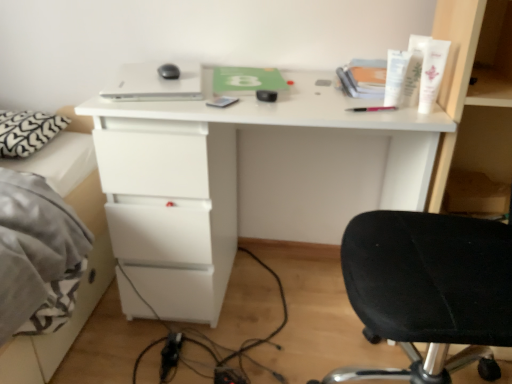
Locate an element on the screen. white plastic tube at upper right, the second toiletry when ordered from left to right is located at coordinates (413, 71).

The height and width of the screenshot is (384, 512). What do you see at coordinates (27, 131) in the screenshot?
I see `white heart-patterned pillow at left` at bounding box center [27, 131].

At what (x,y) coordinates should I click in order to perform the action: click on matte gray notepad at center. Please return your answer as a coordinate pair (x, y). Image resolution: width=512 pixels, height=384 pixels. Looking at the image, I should click on (222, 101).

Find the location of `white cream tube at upper right, the 3th toiletry positioned from the right`. white cream tube at upper right, the 3th toiletry positioned from the right is located at coordinates (395, 76).

Is white heart-patterned pillow at left taller or shorter than white plastic tube at upper right, the 3th toiletry when ordered from left to right?

Clearly, white heart-patterned pillow at left is shorter compared to white plastic tube at upper right, the 3th toiletry when ordered from left to right.

Considering the positions of objects white heart-patterned pillow at left and white plastic tube at upper right, which is counted as the 1th toiletry, starting from the right, in the image provided, who is more to the left, white heart-patterned pillow at left or white plastic tube at upper right, which is counted as the 1th toiletry, starting from the right,?

Positioned to the left is white heart-patterned pillow at left.

From a real-world perspective, which object stands above the other?

white plastic tube at upper right, which is counted as the 1th toiletry, starting from the right, is physically above.

Is matte gray notepad at center next to white cream tube at upper right, which is counted as the first toiletry, starting from the left?

There is a gap between matte gray notepad at center and white cream tube at upper right, which is counted as the first toiletry, starting from the left.

Is matte gray notepad at center facing towards white cream tube at upper right, the 3th toiletry positioned from the right?

No, matte gray notepad at center is not aimed at white cream tube at upper right, the 3th toiletry positioned from the right.

How many degrees apart are the facing directions of matte gray notepad at center and white cream tube at upper right, which is counted as the first toiletry, starting from the left?

2.25 degrees separate the facing orientations of matte gray notepad at center and white cream tube at upper right, which is counted as the first toiletry, starting from the left.

Find the location of `notepad below the white cream tube at upper right, the 3th toiletry positioned from the right (from the image's perspective)`. notepad below the white cream tube at upper right, the 3th toiletry positioned from the right (from the image's perspective) is located at coordinates (222, 101).

From a real-world perspective, between white matte desk at center and white plastic tube at upper right, which is counted as the 1th toiletry, starting from the right, who is vertically higher?

white plastic tube at upper right, which is counted as the 1th toiletry, starting from the right, from a real-world perspective.

Considering the sizes of objects white matte desk at center and white plastic tube at upper right, the 3th toiletry when ordered from left to right, in the image provided, who is bigger, white matte desk at center or white plastic tube at upper right, the 3th toiletry when ordered from left to right,?

white matte desk at center is bigger.

From the picture: Is white matte desk at center aimed at white plastic tube at upper right, the 3th toiletry when ordered from left to right?

No, white matte desk at center is not aimed at white plastic tube at upper right, the 3th toiletry when ordered from left to right.

Considering the points (173, 147) and (406, 85), which point is behind, point (173, 147) or point (406, 85)?

Positioned behind is point (173, 147).

Is white matte desk at center not close to white plastic tube at upper right, the second toiletry when ordered from left to right?

That's not correct — white matte desk at center is a little close to white plastic tube at upper right, the second toiletry when ordered from left to right.

Is white matte desk at center in front of or behind white plastic tube at upper right, which is the 2th toiletry in right-to-left order, in the image?

Clearly, white matte desk at center is in front of white plastic tube at upper right, which is the 2th toiletry in right-to-left order.

Can you tell me how much matte gray notepad at center and white heart-patterned pillow at left differ in facing direction?

They differ by 112 degrees in their facing directions.

Is matte gray notepad at center aimed at white heart-patterned pillow at left?

No, matte gray notepad at center does not turn towards white heart-patterned pillow at left.

Would you say white heart-patterned pillow at left is part of matte gray notepad at center's contents?

Actually, white heart-patterned pillow at left is outside matte gray notepad at center.

How far apart are matte gray notepad at center and white heart-patterned pillow at left?

matte gray notepad at center and white heart-patterned pillow at left are 25.78 inches apart.

In the scene shown: Which object is further away from the camera, white matte desk at center or white heart-patterned pillow at left?

white heart-patterned pillow at left is further away from the camera.

Considering the sizes of objects white matte desk at center and white heart-patterned pillow at left in the image provided, who is taller, white matte desk at center or white heart-patterned pillow at left?

Standing taller between the two is white matte desk at center.

Is white matte desk at center inside or outside of white heart-patterned pillow at left?

white matte desk at center is outside white heart-patterned pillow at left.

The width and height of the screenshot is (512, 384). I want to click on notepad that is above the white heart-patterned pillow at left (from the image's perspective), so click(x=222, y=101).

Which is more to the right, white heart-patterned pillow at left or matte gray notepad at center?

From the viewer's perspective, matte gray notepad at center appears more on the right side.

Does white heart-patterned pillow at left come in front of matte gray notepad at center?

No, the depth of white heart-patterned pillow at left is greater than that of matte gray notepad at center.

Does white heart-patterned pillow at left turn towards matte gray notepad at center?

Yes, white heart-patterned pillow at left is facing matte gray notepad at center.

Locate an element on the screen. The width and height of the screenshot is (512, 384). toiletry that is the 3rd object located in front of the white heart-patterned pillow at left is located at coordinates (431, 72).

In order to click on notepad below the white cream tube at upper right, which is counted as the first toiletry, starting from the left (from the image's perspective) in this screenshot , I will do `click(222, 101)`.

Based on their spatial positions, is matte gray notepad at center or white heart-patterned pillow at left closer to white plastic tube at upper right, the 3th toiletry when ordered from left to right?

Based on the image, matte gray notepad at center appears to be nearer to white plastic tube at upper right, the 3th toiletry when ordered from left to right.

When comparing their distances from white cream tube at upper right, which is counted as the first toiletry, starting from the left, does white plastic tube at upper right, which is counted as the 1th toiletry, starting from the right, or white heart-patterned pillow at left seem closer?

Among the two, white plastic tube at upper right, which is counted as the 1th toiletry, starting from the right, is located nearer to white cream tube at upper right, which is counted as the first toiletry, starting from the left.

From the picture: Based on their spatial positions, is white heart-patterned pillow at left or white matte desk at center further from white plastic tube at upper right, the 3th toiletry when ordered from left to right?

white heart-patterned pillow at left is further to white plastic tube at upper right, the 3th toiletry when ordered from left to right.

Considering their positions, is white plastic tube at upper right, the second toiletry when ordered from left to right, positioned closer to matte gray notepad at center than white heart-patterned pillow at left?

white plastic tube at upper right, the second toiletry when ordered from left to right, is positioned closer to the anchor matte gray notepad at center.

When comparing their distances from white matte desk at center, does white heart-patterned pillow at left or white plastic tube at upper right, which is the 2th toiletry in right-to-left order, seem further?

white heart-patterned pillow at left lies further to white matte desk at center than the other object.

When comparing their distances from white plastic tube at upper right, the second toiletry when ordered from left to right, does matte gray notepad at center or white cream tube at upper right, which is counted as the first toiletry, starting from the left, seem further?

matte gray notepad at center is further to white plastic tube at upper right, the second toiletry when ordered from left to right.

Considering their positions, is white matte desk at center positioned closer to matte gray notepad at center than white plastic tube at upper right, the 3th toiletry when ordered from left to right?

The object closer to matte gray notepad at center is white matte desk at center.

Looking at the image, which one is located further to white plastic tube at upper right, the second toiletry when ordered from left to right, white matte desk at center or matte gray notepad at center?

The object further to white plastic tube at upper right, the second toiletry when ordered from left to right, is white matte desk at center.

Find the location of a particular element. The width and height of the screenshot is (512, 384). notepad between white heart-patterned pillow at left and white matte desk at center in the horizontal direction is located at coordinates point(222,101).

Find the location of a particular element. toiletry located between white heart-patterned pillow at left and white plastic tube at upper right, which is the 2th toiletry in right-to-left order, in the left-right direction is located at coordinates (395, 76).

Identify the location of toiletry between white matte desk at center and white plastic tube at upper right, the second toiletry when ordered from left to right, from left to right. The width and height of the screenshot is (512, 384). (395, 76).

Locate an element on the screen. desk between matte gray notepad at center and white plastic tube at upper right, the second toiletry when ordered from left to right, from left to right is located at coordinates (251, 178).